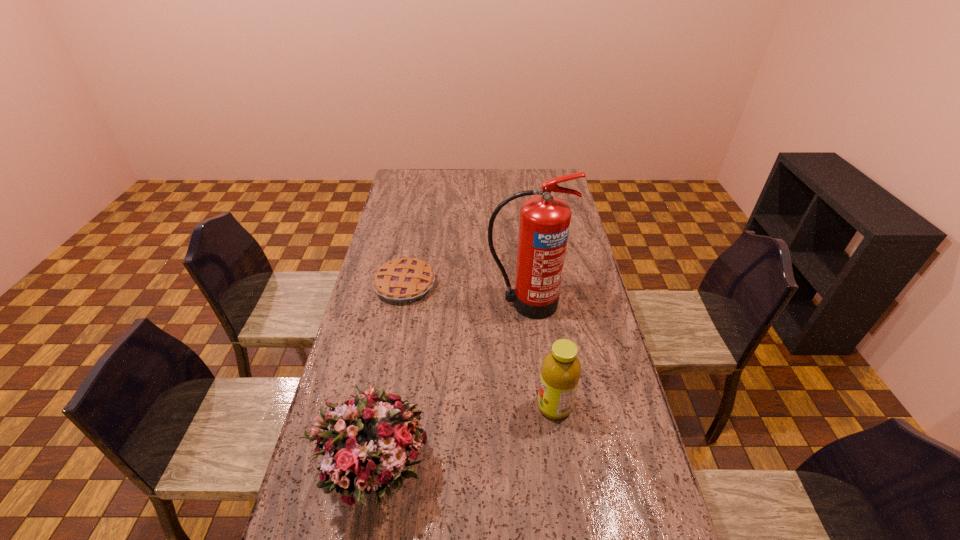
I want to click on the tallest object, so click(x=544, y=224).

Locate an element on the screen. The width and height of the screenshot is (960, 540). fruit juice is located at coordinates (560, 372).

Where is `bouquet`? The width and height of the screenshot is (960, 540). bouquet is located at coordinates (371, 436).

Identify the location of pie. (402, 280).

This screenshot has height=540, width=960. Identify the location of vacant space located on the surface of the fire extinguisher. (536, 393).

Locate an element on the screen. The image size is (960, 540). free space located 0.230m on the front label of the fruit juice is located at coordinates (457, 406).

The image size is (960, 540). I want to click on vacant space situated on the front label of the fruit juice, so 502,406.

Locate an element on the screen. vacant area located on the front label of the fruit juice is located at coordinates (498, 406).

You are a GUI agent. You are given a task and a screenshot of the screen. Output one action in this format:
    pyautogui.click(x=<x>, y=<y>)
    Task: Click on the vacant space positioned 0.380m on the back of the bouquet
    Image resolution: width=960 pixels, height=540 pixels.
    Given the screenshot: What is the action you would take?
    pyautogui.click(x=399, y=322)

Find the location of a particular element. free point located 0.330m on the front of the pie is located at coordinates (386, 383).